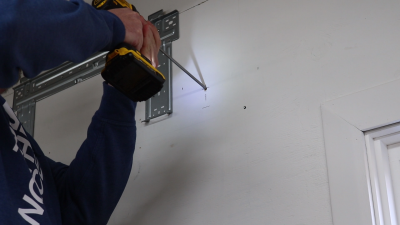
This screenshot has width=400, height=225. What are the coordinates of `door jam` in the screenshot? It's located at (335, 145).